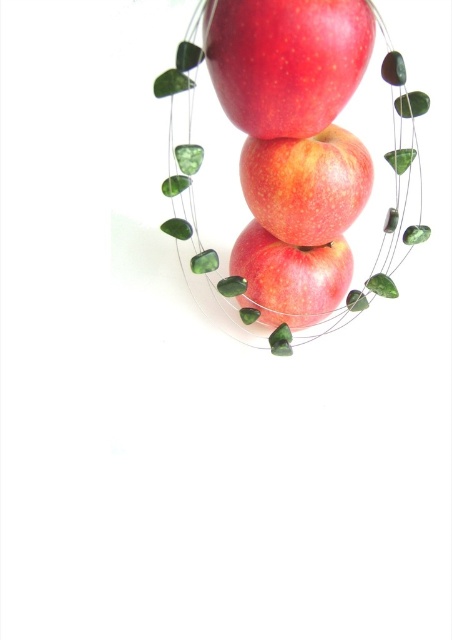
Question: Can you confirm if green gemstone necklace at center is thinner than red matte apple at center?

Choices:
 (A) yes
 (B) no

Answer: (B)

Question: Which of these objects is positioned closest to the red matte apple at center?

Choices:
 (A) green gemstone necklace at center
 (B) glossy red apple at center
 (C) shiny red apple at center

Answer: (A)

Question: Estimate the real-world distances between objects in this image. Which object is closer to the shiny red apple at center?

Choices:
 (A) red matte apple at center
 (B) green gemstone necklace at center
 (C) glossy red apple at center

Answer: (B)

Question: Can you confirm if green gemstone necklace at center is positioned below glossy red apple at center?

Choices:
 (A) yes
 (B) no

Answer: (B)

Question: Which object is farther from the camera taking this photo?

Choices:
 (A) green gemstone necklace at center
 (B) glossy red apple at center
 (C) shiny red apple at center
 (D) red matte apple at center

Answer: (B)

Question: Does red matte apple at center lie in front of glossy red apple at center?

Choices:
 (A) yes
 (B) no

Answer: (A)